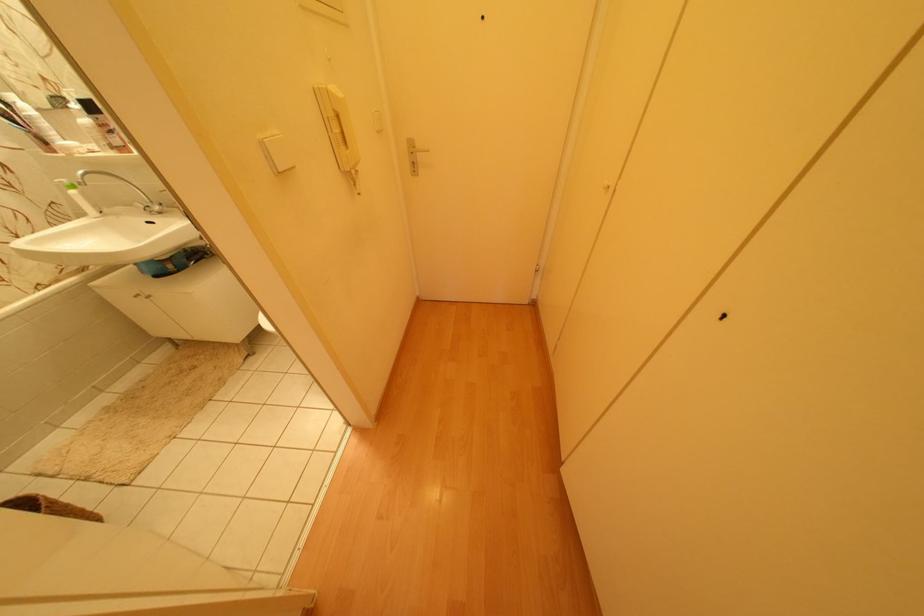
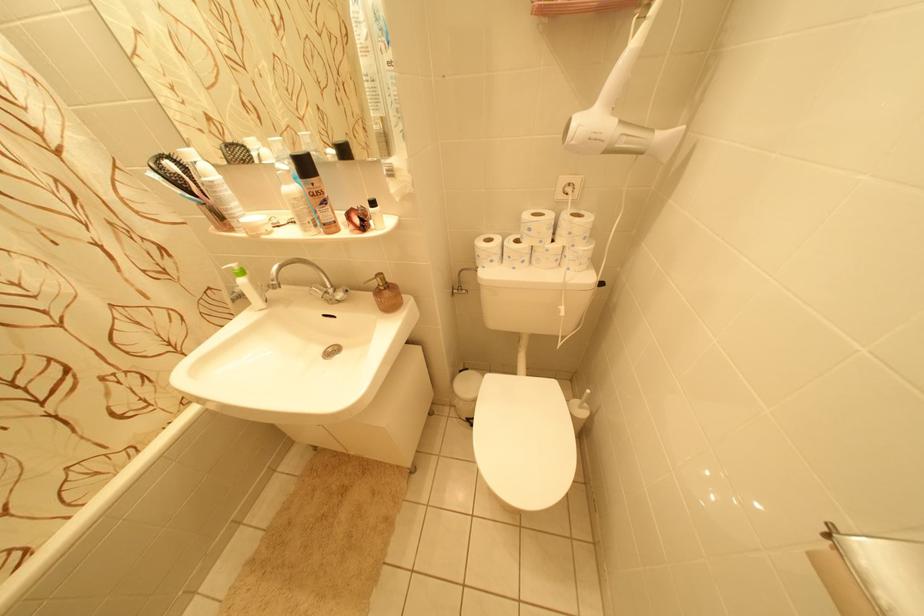
What movement of the cameraman would produce the second image?

The cameraman moved toward left, forward.